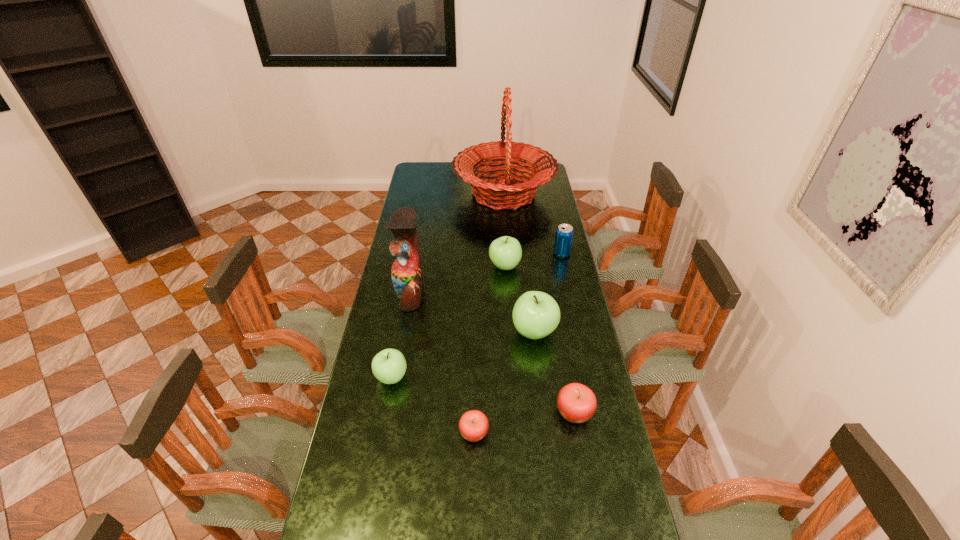
You are a GUI agent. You are given a task and a screenshot of the screen. Output one action in this format:
    pyautogui.click(x=<x>, y=<y>)
    Task: Click on the vacant position at the far right corner of the desktop
    
    Given the screenshot: What is the action you would take?
    pyautogui.click(x=522, y=174)

Identify the location of vacant region between the parrot and the second biggest green apple. (458, 279).

Identify the location of free space between the smallest green apple and the smaller red apple. The image size is (960, 540). (433, 405).

Find the location of a particular element. This screenshot has height=540, width=960. vacant region between the farthest green apple and the basket is located at coordinates (504, 230).

Image resolution: width=960 pixels, height=540 pixels. Find the location of `empty space between the blue pop soda and the right red apple`. empty space between the blue pop soda and the right red apple is located at coordinates (568, 333).

Identify the location of free space between the pop soda and the biggest green apple. The height and width of the screenshot is (540, 960). (548, 293).

Where is `blank region between the pop soda and the second tallest apple`? The image size is (960, 540). blank region between the pop soda and the second tallest apple is located at coordinates (533, 260).

At what (x,y) coordinates should I click in order to perform the action: click on free space between the farthest object and the second tallest object. Please return your answer as a coordinate pair (x, y). This screenshot has width=960, height=540. Looking at the image, I should click on (457, 243).

I want to click on free space between the pop soda and the second smallest green apple, so point(533,260).

Where is `blank region between the tallest object and the pop soda`? blank region between the tallest object and the pop soda is located at coordinates (533, 224).